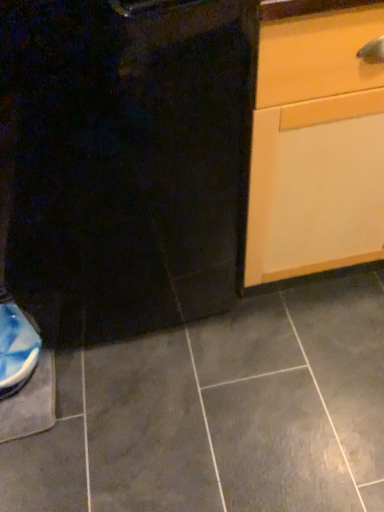
Question: Should I look upward or downward to see light wood cabinet at right?

Choices:
 (A) down
 (B) up

Answer: (B)